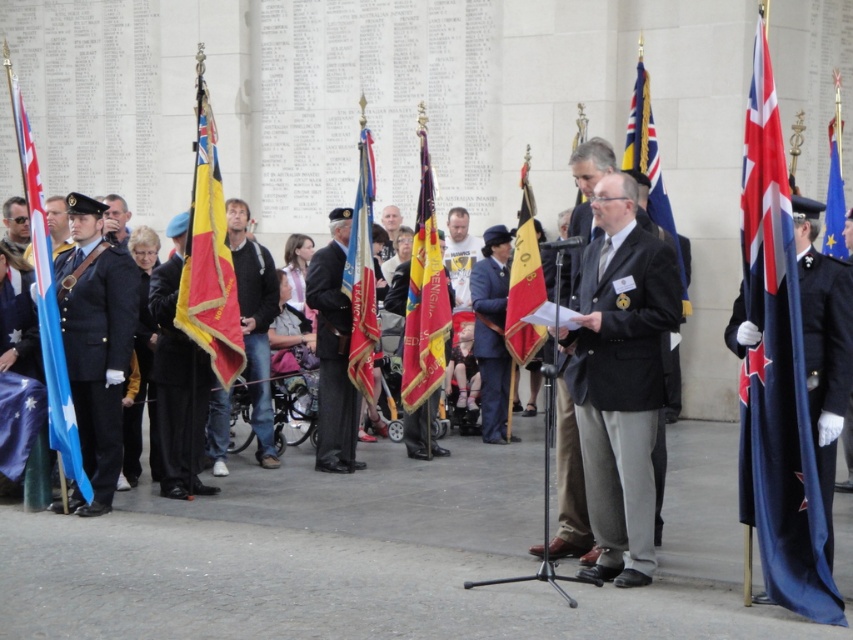
What is located at the coordinates point (x=177, y=388)?

The black fabric uniform at center is located at point (x=177, y=388).

You are attending the commemorative ceremony and want to take a photo of both the speaker and the flag bearers. If you position yourself so that the speaker is at point (180, 477) and the flag bearers are at point (245, 205) in your camera viewfinder, which group will appear larger in your photo?

The speaker at point (180, 477) will appear larger in the photo because they are closer to the viewer compared to the flag bearers at point (245, 205).